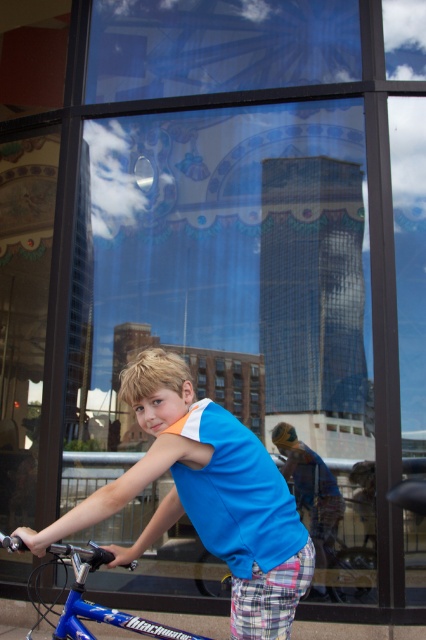
You are a photographer trying to capture the boy riding the blue metallic bicycle at lower left while ensuring the blue cotton shirt at center is visible in the reflection of the glass window. Is the shirt likely to be visible in the reflection?

The blue cotton shirt at center is positioned over the blue metallic bicycle at lower left, so the shirt is likely visible in the reflection of the glass window as it is above the bicycle and within the reflective surface.

You are standing in the room where the boy is riding his bicycle. You want to place a small potted plant exactly at the point marked as point (x=273, y=497). If you are currently 6.62 feet away from this point, can you reach it without moving more than 5 feet?

The point (x=273, y=497) is 6.62 feet away from you, which is more than 5 feet. Therefore, you cannot reach it without moving more than 5 feet.